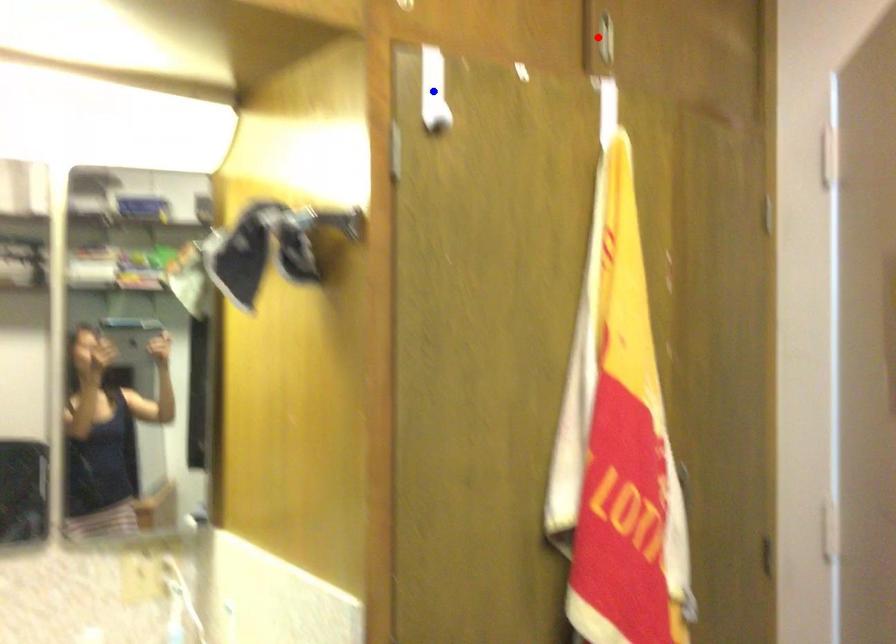
Question: Which of the two points in the image is closer to the camera?

Choices:
 (A) Blue point is closer.
 (B) Red point is closer.

Answer: (A)